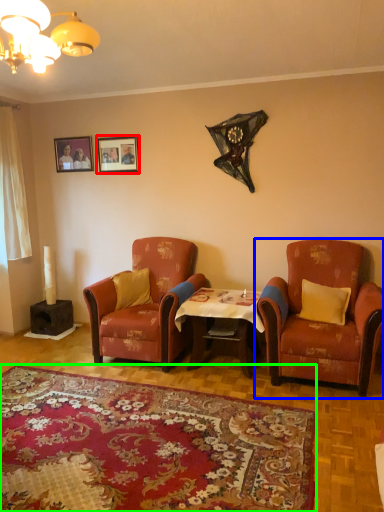
Question: Based on their relative distances, which object is farther from picture frame (highlighted by a red box)? Choose from chair (highlighted by a blue box) and plain (highlighted by a green box).

Choices:
 (A) chair
 (B) plain

Answer: (B)